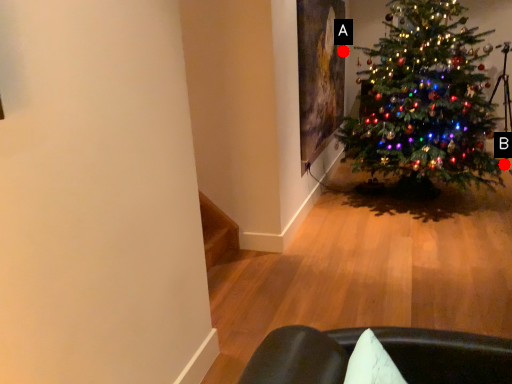
Question: Two points are circled on the image, labeled by A and B beside each circle. Which point is farther to the camera?

Choices:
 (A) A is further
 (B) B is further

Answer: (A)